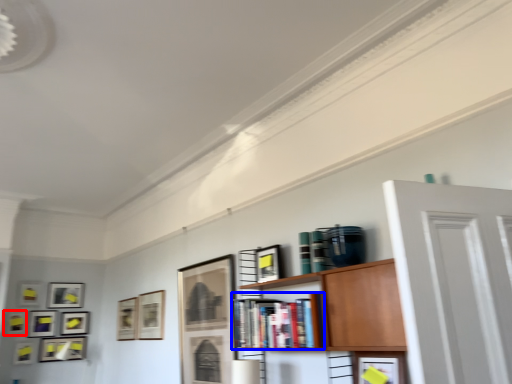
Question: Which of the following is the farthest to the observer, picture frame (highlighted by a red box) or book (highlighted by a blue box)?

Choices:
 (A) picture frame
 (B) book

Answer: (A)